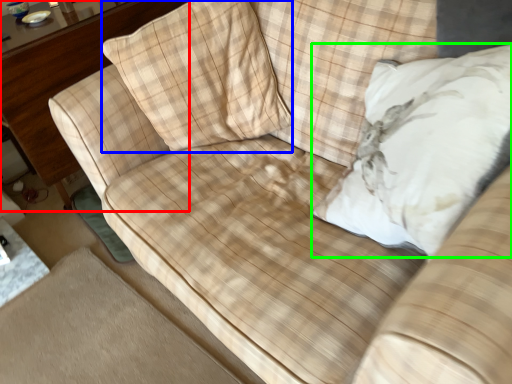
Question: Based on their relative distances, which object is nearer to dresser (highlighted by a red box)? Choose from throw pillow (highlighted by a blue box) and throw pillow (highlighted by a green box).

Choices:
 (A) throw pillow
 (B) throw pillow

Answer: (A)